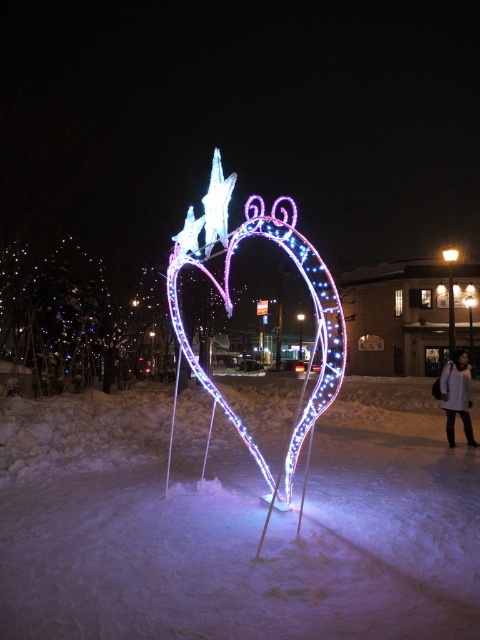
Based on the photo, you are a delivery robot with a 1.2 meter wide package. You need to navigate through the icy white snow at center to reach the delivery point near the white wool coat at lower right. Can you safely pass through the snow area without the package getting stuck?

The icy white snow at center might be wider than the white wool coat at lower right, but since the description only states a possibility and not a confirmed measurement, it is uncertain if the 1.2 meter wide package can safely pass. Proceed with caution and consider an alternative route if available.

You are standing in front of the heart light installation and want to take a photo. There are two points marked on the heart structure at coordinates point [33,548] and point [291,460]. Which point is closer to you when you are facing the heart?

Point [33,548] is closer to the camera than point [291,460], so when facing the heart, point [33,548] will be closer to you.

You are standing in the winter scene and want to take a photo of the icy white snow at center and the illuminated plastic heart at center. Which object will appear larger in your photo?

The icy white snow at center will appear larger in your photo because it is closer to the viewer than the illuminated plastic heart at center.